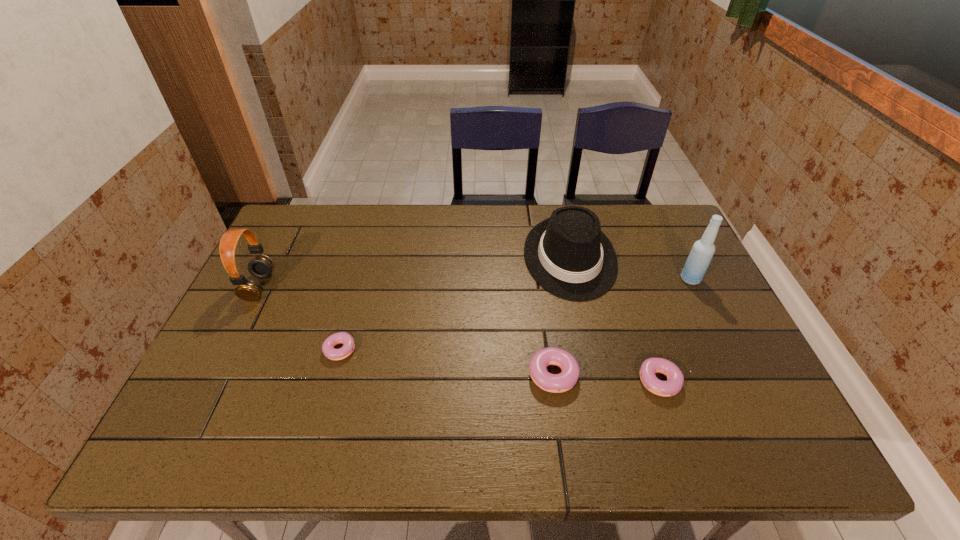
Locate an element on the screen. This screenshot has width=960, height=540. the shortest object is located at coordinates (346, 339).

Locate an element on the screen. Image resolution: width=960 pixels, height=540 pixels. the shortest doughnut is located at coordinates (346, 339).

The image size is (960, 540). I want to click on the third shortest object, so click(556, 383).

This screenshot has width=960, height=540. In order to click on the tallest doughnut in this screenshot , I will do `click(556, 383)`.

You are a GUI agent. You are given a task and a screenshot of the screen. Output one action in this format:
    pyautogui.click(x=<x>, y=<y>)
    Task: Click on the fifth tallest object
    
    Given the screenshot: What is the action you would take?
    pyautogui.click(x=675, y=379)

At what (x,y) coordinates should I click in order to perform the action: click on the second shortest doughnut. Please return your answer as a coordinate pair (x, y). Image resolution: width=960 pixels, height=540 pixels. Looking at the image, I should click on (675, 379).

Where is `headset`? headset is located at coordinates (261, 266).

Image resolution: width=960 pixels, height=540 pixels. Identify the location of the fifth shortest object. (261, 266).

This screenshot has height=540, width=960. Find the location of `the fourth shortest object`. the fourth shortest object is located at coordinates (567, 254).

You are a GUI agent. You are given a task and a screenshot of the screen. Output one action in this format:
    pyautogui.click(x=<x>, y=<y>)
    Task: Click on the tallest object
    The height and width of the screenshot is (540, 960).
    Given the screenshot: What is the action you would take?
    pyautogui.click(x=698, y=261)